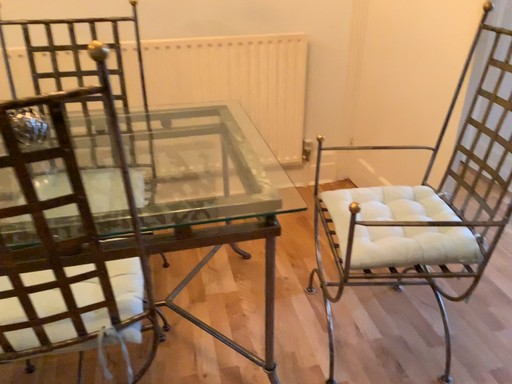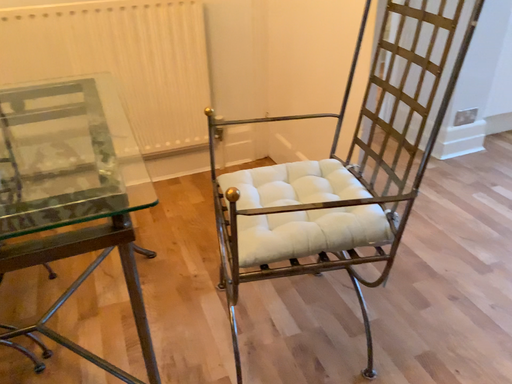
Question: Which way did the camera rotate in the video?

Choices:
 (A) rotated left
 (B) rotated right

Answer: (B)